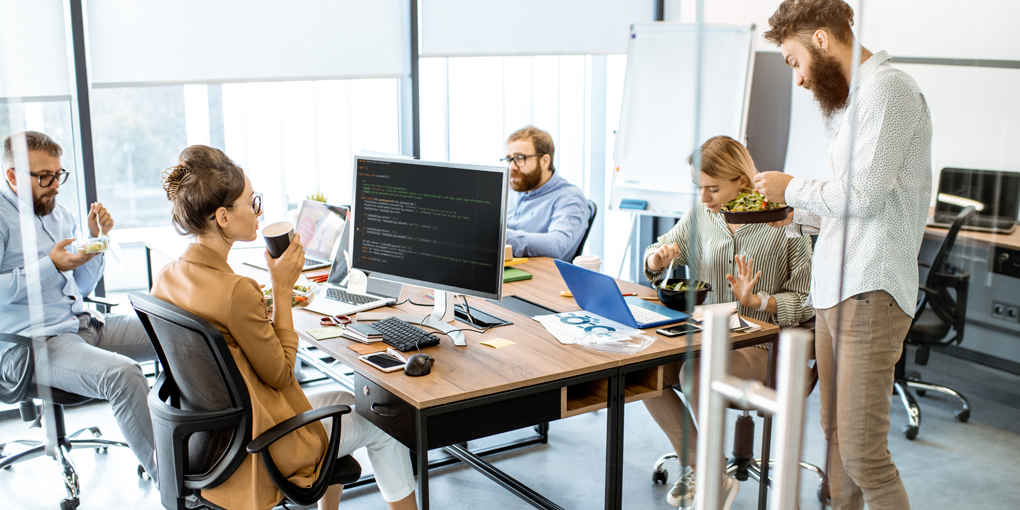
Where is `chair`? Image resolution: width=1020 pixels, height=510 pixels. chair is located at coordinates (210, 495), (64, 436), (936, 321), (741, 439), (576, 250).